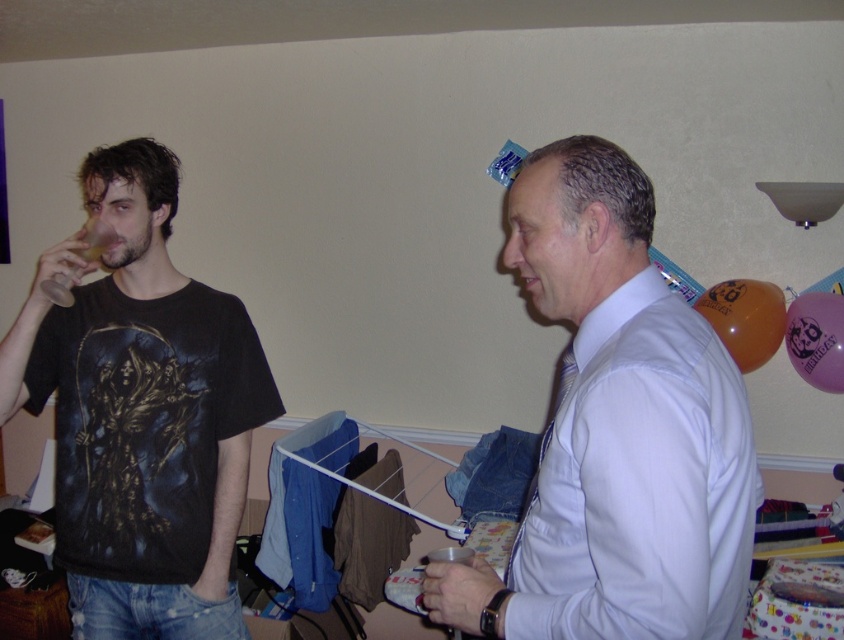
How much distance is there between white glossy shirt at center and translucent orange balloon at upper right?

white glossy shirt at center and translucent orange balloon at upper right are 4.60 feet apart from each other.

Who is higher up, white glossy shirt at center or translucent orange balloon at upper right?

translucent orange balloon at upper right

Is point (507, 205) positioned before point (750, 346)?

Yes, it is in front of point (750, 346).

Find the location of a particular element. Image resolution: width=844 pixels, height=640 pixels. white glossy shirt at center is located at coordinates (617, 433).

How far apart are white glossy shirt at center and black matte t-shirt at left?

They are 33.76 inches apart.

Can you confirm if white glossy shirt at center is positioned to the right of black matte t-shirt at left?

Indeed, white glossy shirt at center is positioned on the right side of black matte t-shirt at left.

Does point (591, 394) lie behind point (255, 388)?

No, it is in front of (255, 388).

Where is `white glossy shirt at center`? This screenshot has height=640, width=844. white glossy shirt at center is located at coordinates (617, 433).

Which of these two, black matte t-shirt at left or pink latex balloon at upper right, stands shorter?

Standing shorter between the two is pink latex balloon at upper right.

Does point (42, 340) come behind point (787, 320)?

No, (42, 340) is closer to viewer.

Locate an element on the screen. The image size is (844, 640). black matte t-shirt at left is located at coordinates (141, 412).